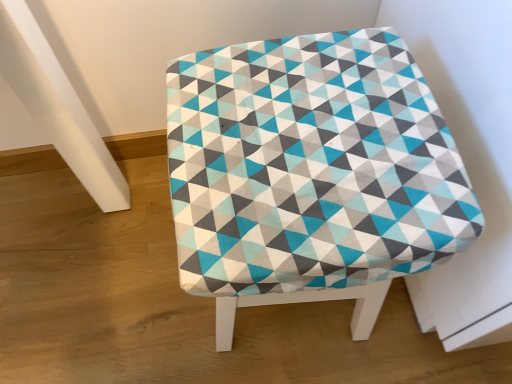
This screenshot has height=384, width=512. Find the location of `empty space that is ontop of teal-patterned fabric stool at center (from a real-world perspective)`. empty space that is ontop of teal-patterned fabric stool at center (from a real-world perspective) is located at coordinates pos(310,137).